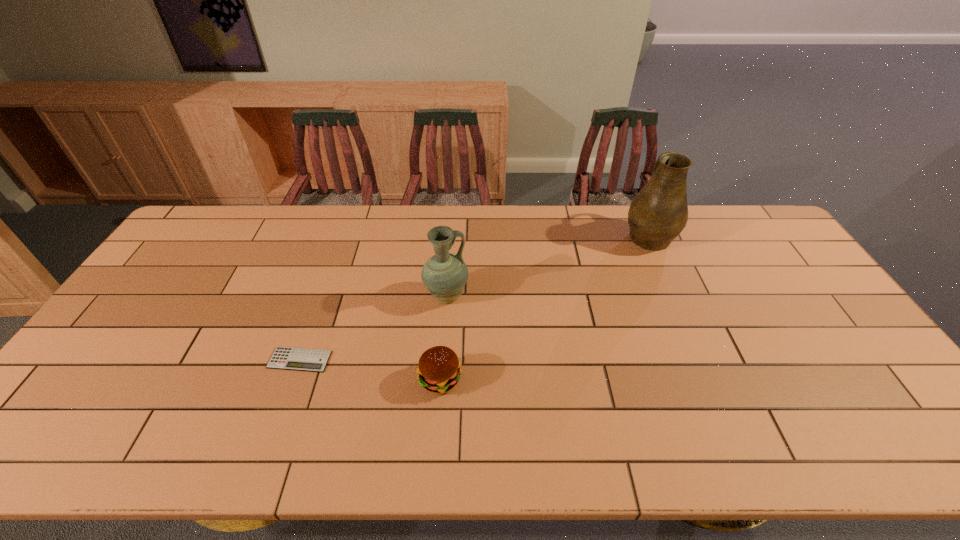
This screenshot has width=960, height=540. Find the location of `the farthest object`. the farthest object is located at coordinates (659, 212).

You are a GUI agent. You are given a task and a screenshot of the screen. Output one action in this format:
    pyautogui.click(x=<x>, y=<y>)
    Task: Click on the taller pitcher
    The image size is (960, 540).
    Given the screenshot: What is the action you would take?
    pyautogui.click(x=659, y=212)

What are the coordinates of `the left pitcher` in the screenshot? It's located at (445, 274).

Locate an element on the screen. Image resolution: width=960 pixels, height=540 pixels. the shorter pitcher is located at coordinates coord(445,274).

The width and height of the screenshot is (960, 540). In order to click on the second shortest object in this screenshot , I will do click(x=438, y=370).

Find the location of a particular element. This screenshot has width=960, height=540. the shortest object is located at coordinates (286, 358).

Locate an element on the screen. Image resolution: width=960 pixels, height=540 pixels. calculator is located at coordinates (286, 358).

Where is `vacant space located 0.370m on the handle side of the shorter pitcher`? vacant space located 0.370m on the handle side of the shorter pitcher is located at coordinates coord(593,296).

Identify the location of free space located 0.120m on the back of the third tallest object. (444, 326).

This screenshot has height=540, width=960. What are the coordinates of `free space located on the right of the calculator` in the screenshot? It's located at (410, 360).